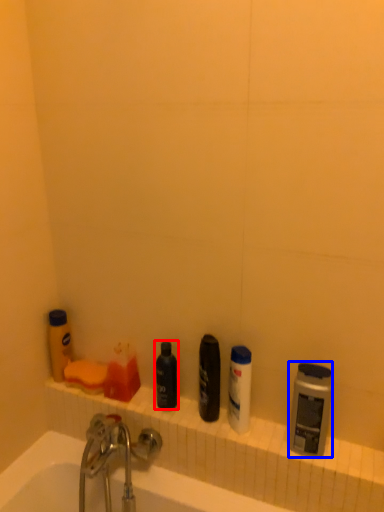
Question: Among these objects, which one is farthest to the camera, toiletry (highlighted by a red box) or toiletry (highlighted by a blue box)?

Choices:
 (A) toiletry
 (B) toiletry

Answer: (A)